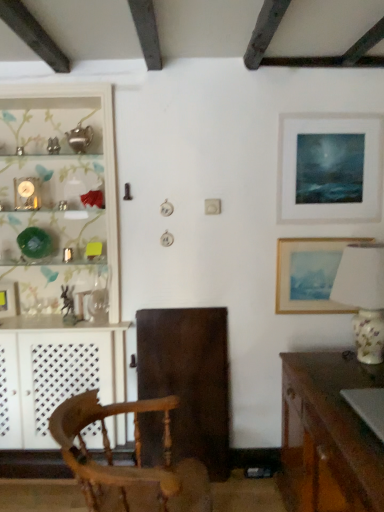
Identify the location of wooden chair at center. Image resolution: width=384 pixels, height=512 pixels. (125, 466).

I want to click on porcelain floral lamp at right, so click(363, 296).

In order to face porcelain floral lamp at right, should I rotate leftwards or rightwards?

You should look right and rotate roughly 22.588 degrees.

This screenshot has width=384, height=512. What are the coordinates of `matte glass shelf at left` in the screenshot? It's located at point(103,153).

At what (x,y) coordinates should I click in order to perform the action: click on shelf above the metallic rectangular frame at left, positioned as the third picture frame in right-to-left order (from a real-world perspective). Please return your answer as a coordinate pair (x, y). Looking at the image, I should click on (103, 153).

Is matte glass shelf at left not near metallic rectangular frame at left, positioned as the third picture frame in right-to-left order?

Actually, matte glass shelf at left and metallic rectangular frame at left, positioned as the third picture frame in right-to-left order, are a little close together.

Which point is more forward, (77, 86) or (0, 287)?

The point (77, 86) is more forward.

In the scene shown: Is there a large distance between matte white picture frame at upper right, the 1th picture frame viewed from the right, and wooden chair at center?

Indeed, matte white picture frame at upper right, the 1th picture frame viewed from the right, is not near wooden chair at center.

Considering the positions of points (316, 221) and (107, 405), is point (316, 221) closer to camera compared to point (107, 405)?

No, it is behind (107, 405).

Looking at this image, would you say matte white picture frame at upper right, which is counted as the 3th picture frame, starting from the bottom, is outside wooden chair at center?

matte white picture frame at upper right, which is counted as the 3th picture frame, starting from the bottom, lies outside wooden chair at center's area.

Is the depth of porcelain floral lamp at right less than that of wooden desk at lower right?

No, it is behind wooden desk at lower right.

From a real-world perspective, is porcelain floral lamp at right positioned over wooden desk at lower right based on gravity?

Correct, in the physical world, porcelain floral lamp at right is higher than wooden desk at lower right.

Does porcelain floral lamp at right have a lesser width compared to wooden desk at lower right?

Correct, the width of porcelain floral lamp at right is less than that of wooden desk at lower right.

How different are the orientations of porcelain floral lamp at right and wooden desk at lower right in degrees?

The angular difference between porcelain floral lamp at right and wooden desk at lower right is 4.02 degrees.

Does matte glass shelf at left have a smaller size compared to matte white picture frame at upper right, the 1th picture frame viewed from the right?

No, matte glass shelf at left is not smaller than matte white picture frame at upper right, the 1th picture frame viewed from the right.

From a real-world perspective, is matte glass shelf at left under matte white picture frame at upper right, the 1th picture frame viewed from the right?

Yes, from a real-world perspective, matte glass shelf at left is under matte white picture frame at upper right, the 1th picture frame viewed from the right.

Locate an element on the screen. shelf in front of the matte white picture frame at upper right, the first picture frame positioned from the top is located at coordinates (103, 153).

Is matte glass shelf at left facing away from matte white picture frame at upper right, the first picture frame positioned from the top?

No.

Would you say wooden desk at lower right contains metallic rectangular frame at left, the first picture frame in the left-to-right sequence?

Definitely not — metallic rectangular frame at left, the first picture frame in the left-to-right sequence, is not inside wooden desk at lower right.

Is wooden desk at lower right oriented away from metallic rectangular frame at left, the first picture frame in the bottom-to-top sequence?

No, wooden desk at lower right is not facing away from metallic rectangular frame at left, the first picture frame in the bottom-to-top sequence.

Can you confirm if wooden desk at lower right is bigger than metallic rectangular frame at left, the first picture frame in the bottom-to-top sequence?

Yes.

In the image, is wooden desk at lower right on the left side or the right side of metallic rectangular frame at left, positioned as the third picture frame in top-to-bottom order?

Clearly, wooden desk at lower right is on the right of metallic rectangular frame at left, positioned as the third picture frame in top-to-bottom order, in the image.

Could you tell me if wooden chair at center is turned towards matte white picture frame at upper right, the 1th picture frame viewed from the right?

No, wooden chair at center is not oriented towards matte white picture frame at upper right, the 1th picture frame viewed from the right.

Is wooden chair at center at the left side of matte white picture frame at upper right, which ranks as the third picture frame in left-to-right order?

Yes, wooden chair at center is to the left of matte white picture frame at upper right, which ranks as the third picture frame in left-to-right order.

From the image's perspective, is wooden chair at center above matte white picture frame at upper right, which ranks as the third picture frame in left-to-right order?

No, from the image's perspective, wooden chair at center is not above matte white picture frame at upper right, which ranks as the third picture frame in left-to-right order.

Which of these two, matte glass shelf at left or wooden picture frame at right, acting as the 2th picture frame starting from the top, stands shorter?

Standing shorter between the two is wooden picture frame at right, acting as the 2th picture frame starting from the top.

Which is farther, (111, 143) or (305, 292)?

The point (111, 143) is behind.

Considering the relative positions of matte glass shelf at left and wooden picture frame at right, the second picture frame from the bottom, in the image provided, is matte glass shelf at left to the left of wooden picture frame at right, the second picture frame from the bottom, from the viewer's perspective?

Correct, you'll find matte glass shelf at left to the left of wooden picture frame at right, the second picture frame from the bottom.

I want to click on picture frame to the left of matte glass shelf at left, so click(9, 298).

The width and height of the screenshot is (384, 512). I want to click on chair that appears below the matte white picture frame at upper right, the first picture frame positioned from the top (from the image's perspective), so click(125, 466).

Looking at the image, which one is located closer to wooden picture frame at right, acting as the 2th picture frame starting from the top, porcelain floral lamp at right or matte white picture frame at upper right, which is counted as the 3th picture frame, starting from the bottom?

matte white picture frame at upper right, which is counted as the 3th picture frame, starting from the bottom, lies closer to wooden picture frame at right, acting as the 2th picture frame starting from the top, than the other object.

From the picture: Based on their spatial positions, is porcelain floral lamp at right or wooden desk at lower right further from matte glass shelf at left?

Among the two, porcelain floral lamp at right is located further to matte glass shelf at left.

Consider the image. When comparing their distances from matte glass shelf at left, does wooden chair at center or porcelain floral lamp at right seem further?

porcelain floral lamp at right is positioned further to the anchor matte glass shelf at left.

From the image, which object appears to be farther from porcelain floral lamp at right, wooden chair at center or matte glass shelf at left?

matte glass shelf at left is positioned further to the anchor porcelain floral lamp at right.

Estimate the real-world distances between objects in this image. Which object is closer to wooden picture frame at right, acting as the 2th picture frame starting from the top, matte white picture frame at upper right, which ranks as the third picture frame in left-to-right order, or wooden desk at lower right?

matte white picture frame at upper right, which ranks as the third picture frame in left-to-right order, is positioned closer to the anchor wooden picture frame at right, acting as the 2th picture frame starting from the top.

Considering their positions, is matte glass shelf at left positioned further to matte white picture frame at upper right, which ranks as the third picture frame in left-to-right order, than wooden desk at lower right?

Based on the image, matte glass shelf at left appears to be further to matte white picture frame at upper right, which ranks as the third picture frame in left-to-right order.

From the image, which object appears to be nearer to matte white picture frame at upper right, the 1th picture frame viewed from the right, wooden picture frame at right, acting as the 2th picture frame starting from the top, or metallic rectangular frame at left, positioned as the third picture frame in top-to-bottom order?

wooden picture frame at right, acting as the 2th picture frame starting from the top.

When comparing their distances from porcelain floral lamp at right, does metallic rectangular frame at left, positioned as the third picture frame in top-to-bottom order, or wooden picture frame at right, acting as the 2th picture frame starting from the top, seem further?

metallic rectangular frame at left, positioned as the third picture frame in top-to-bottom order.

Where is `desk between matte glass shelf at left and matte white picture frame at upper right, which ranks as the third picture frame in left-to-right order`? This screenshot has width=384, height=512. desk between matte glass shelf at left and matte white picture frame at upper right, which ranks as the third picture frame in left-to-right order is located at coordinates (331, 430).

Locate an element on the screen. picture frame situated between matte glass shelf at left and wooden desk at lower right from left to right is located at coordinates (309, 275).

Where is `shelf between metallic rectangular frame at left, positioned as the third picture frame in top-to-bottom order, and wooden desk at lower right`? The height and width of the screenshot is (512, 384). shelf between metallic rectangular frame at left, positioned as the third picture frame in top-to-bottom order, and wooden desk at lower right is located at coordinates (103, 153).

Where is `desk situated between matte glass shelf at left and porcelain floral lamp at right from left to right`? The width and height of the screenshot is (384, 512). desk situated between matte glass shelf at left and porcelain floral lamp at right from left to right is located at coordinates (331, 430).